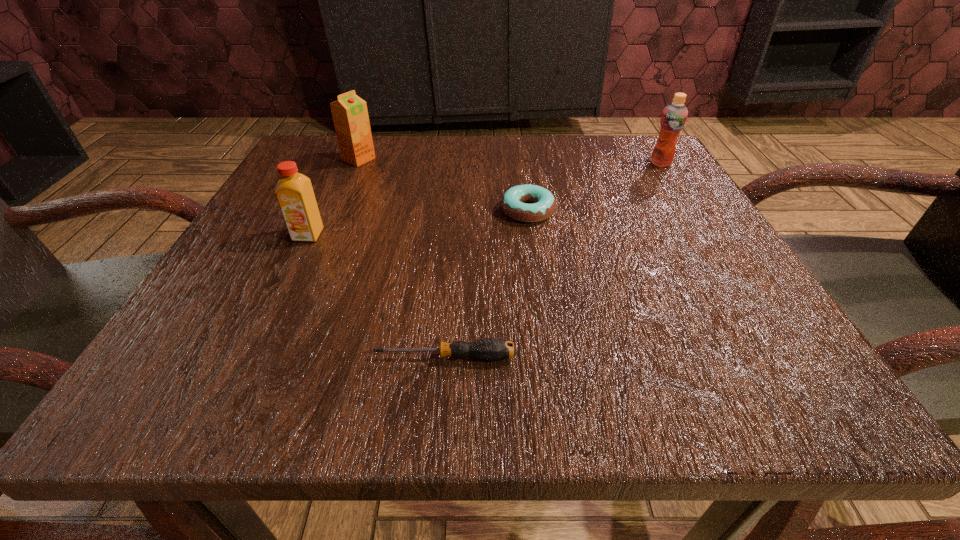
At what (x,y) coordinates should I click in order to perform the action: click on the rightmost object. Please return your answer as a coordinate pair (x, y). The width and height of the screenshot is (960, 540). Looking at the image, I should click on (673, 119).

Image resolution: width=960 pixels, height=540 pixels. In order to click on the second nearest object in this screenshot , I will do `click(294, 192)`.

You are a GUI agent. You are given a task and a screenshot of the screen. Output one action in this format:
    pyautogui.click(x=<x>, y=<y>)
    Task: Click on the doughnut
    The height and width of the screenshot is (540, 960).
    Given the screenshot: What is the action you would take?
    pyautogui.click(x=544, y=203)

Locate an element on the screen. the nearest object is located at coordinates (490, 349).

This screenshot has width=960, height=540. Find the location of `screwdriver`. screwdriver is located at coordinates (490, 349).

The width and height of the screenshot is (960, 540). I want to click on free space located 0.220m on the left of the rightmost object, so click(538, 163).

The image size is (960, 540). I want to click on free space located 0.220m on the front and back of the fourth farthest object, so click(248, 360).

This screenshot has height=540, width=960. In order to click on free space located 0.220m on the right of the third farthest object in this screenshot , I will do `click(686, 211)`.

You are a GUI agent. You are given a task and a screenshot of the screen. Output one action in this format:
    pyautogui.click(x=<x>, y=<y>)
    Task: Click on the vacant space located 0.170m on the left of the shortest object
    
    Given the screenshot: What is the action you would take?
    pyautogui.click(x=228, y=357)

Locate an element on the screen. object that is at the near edge is located at coordinates (490, 349).